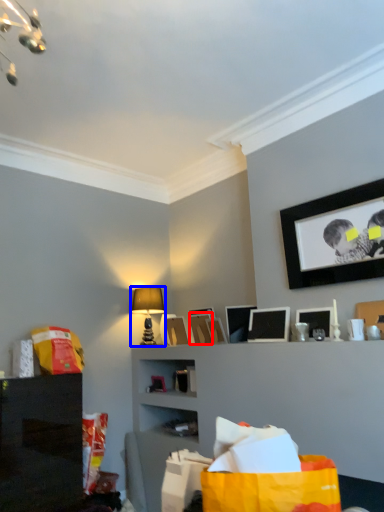
Question: Which object appears farthest to the camera in this image, picture frame (highlighted by a red box) or table lamp (highlighted by a blue box)?

Choices:
 (A) picture frame
 (B) table lamp

Answer: (B)